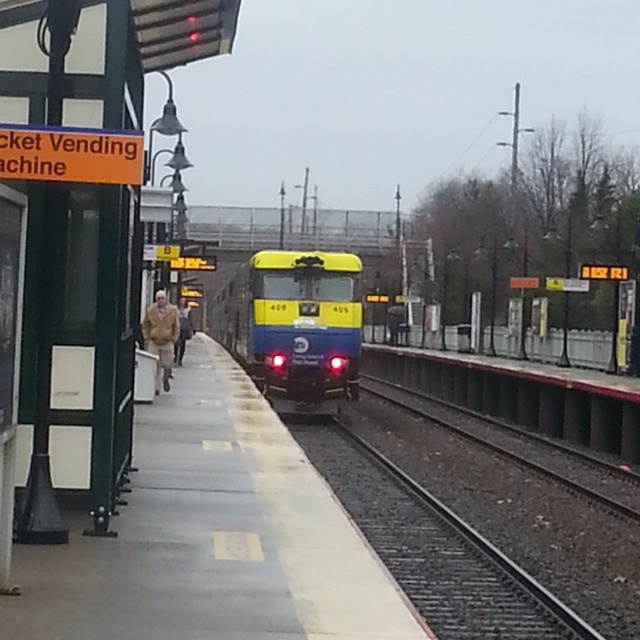
Which of these two, smooth concrete platform at center or brown leather jacket at center, stands shorter?

With less height is smooth concrete platform at center.

Which is more to the left, smooth concrete platform at center or brown leather jacket at center?

brown leather jacket at center

Is point (273, 620) in front of point (180, 298)?

Yes, point (273, 620) is closer to viewer.

The height and width of the screenshot is (640, 640). Identify the location of smooth concrete platform at center. (212, 536).

Based on the photo, between yellow matte train at center and brown leather jacket at left, which one has more height?

yellow matte train at center

Looking at this image, does yellow matte train at center appear on the left side of brown leather jacket at left?

Correct, you'll find yellow matte train at center to the left of brown leather jacket at left.

Between point (280, 250) and point (170, 360), which one is positioned behind?

The point (280, 250) is more distant.

Identify the location of yellow matte train at center. This screenshot has width=640, height=640. (294, 324).

Which is below, smooth concrete platform at center or brown leather jacket at left?

smooth concrete platform at center is lower down.

Can you confirm if smooth concrete platform at center is taller than brown leather jacket at left?

Incorrect, smooth concrete platform at center's height is not larger of brown leather jacket at left's.

You are a GUI agent. You are given a task and a screenshot of the screen. Output one action in this format:
    pyautogui.click(x=<x>, y=<y>)
    Task: Click on the smooth concrete platform at center
    The width and height of the screenshot is (640, 640).
    Given the screenshot: What is the action you would take?
    pyautogui.click(x=212, y=536)

At what (x,y) coordinates should I click in order to perform the action: click on smooth concrete platform at center. Please return your answer as a coordinate pair (x, y). Looking at the image, I should click on (212, 536).